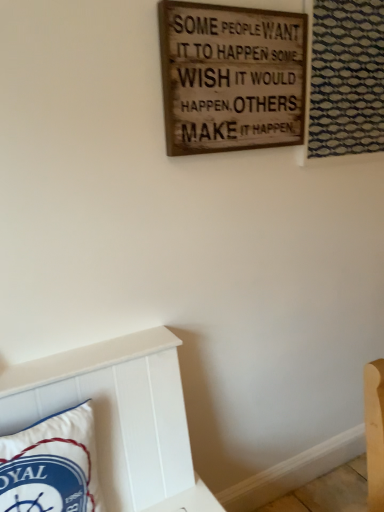
The image size is (384, 512). Find the location of `wooden signboard at upper center`. wooden signboard at upper center is located at coordinates (235, 77).

Find the location of a particular element. The width and height of the screenshot is (384, 512). white fabric pillow at lower left is located at coordinates (52, 465).

At what (x,y) coordinates should I click in order to perform the action: click on wooden signboard at upper center. Please return your answer as a coordinate pair (x, y). This screenshot has width=384, height=512. Looking at the image, I should click on (235, 77).

At what (x,y) coordinates should I click in order to perform the action: click on pillow that appears on the left of wooden signboard at upper center. Please return your answer as a coordinate pair (x, y). Image resolution: width=384 pixels, height=512 pixels. Looking at the image, I should click on (52, 465).

Is wooden signboard at upper center wider or thinner than white fabric pillow at lower left?

In the image, wooden signboard at upper center appears to be more narrow than white fabric pillow at lower left.

From a real-world perspective, between wooden signboard at upper center and white fabric pillow at lower left, who is vertically higher?

wooden signboard at upper center is physically above.

Considering the relative positions of blue textured fabric at upper right and wooden signboard at upper center in the image provided, is blue textured fabric at upper right to the right of wooden signboard at upper center from the viewer's perspective?

Correct, you'll find blue textured fabric at upper right to the right of wooden signboard at upper center.

You are a GUI agent. You are given a task and a screenshot of the screen. Output one action in this format:
    pyautogui.click(x=<x>, y=<y>)
    Task: Click on the tapestry on the right of wooden signboard at upper center
    
    Given the screenshot: What is the action you would take?
    pyautogui.click(x=346, y=78)

Between blue textured fabric at upper right and wooden signboard at upper center, which one has less height?

Standing shorter between the two is wooden signboard at upper center.

Consider the image. Can you tell me how much blue textured fabric at upper right and wooden signboard at upper center differ in facing direction?

The angular difference between blue textured fabric at upper right and wooden signboard at upper center is 0.0471 degrees.

Between blue textured fabric at upper right and white fabric pillow at lower left, which one has larger size?

With larger size is white fabric pillow at lower left.

Based on the photo, from a real-world perspective, which is physically below, blue textured fabric at upper right or white fabric pillow at lower left?

white fabric pillow at lower left, from a real-world perspective.

Based on their positions, is blue textured fabric at upper right located to the left or right of white fabric pillow at lower left?

blue textured fabric at upper right is positioned on white fabric pillow at lower left's right side.

Between blue textured fabric at upper right and white fabric pillow at lower left, which one is positioned behind?

blue textured fabric at upper right.

Based on the photo, from their relative heights in the image, would you say wooden signboard at upper center is taller or shorter than blue textured fabric at upper right?

wooden signboard at upper center is shorter than blue textured fabric at upper right.

Which object is positioned more to the left, wooden signboard at upper center or blue textured fabric at upper right?

From the viewer's perspective, wooden signboard at upper center appears more on the left side.

What's the angular difference between wooden signboard at upper center and blue textured fabric at upper right's facing directions?

They differ by 0.0471 degrees in their facing directions.

Looking at this image, between wooden signboard at upper center and blue textured fabric at upper right, which one has smaller size?

wooden signboard at upper center is smaller.

Who is shorter, white fabric pillow at lower left or blue textured fabric at upper right?

white fabric pillow at lower left.

Do you think white fabric pillow at lower left is within blue textured fabric at upper right, or outside of it?

white fabric pillow at lower left cannot be found inside blue textured fabric at upper right.

Looking at this image, from the image's perspective, which one is positioned higher, white fabric pillow at lower left or blue textured fabric at upper right?

From the image's view, blue textured fabric at upper right is above.

Looking at this image, is white fabric pillow at lower left oriented towards blue textured fabric at upper right?

No, white fabric pillow at lower left is not aimed at blue textured fabric at upper right.

Is white fabric pillow at lower left at the left side of wooden signboard at upper center?

Correct, you'll find white fabric pillow at lower left to the left of wooden signboard at upper center.

Considering the relative sizes of white fabric pillow at lower left and wooden signboard at upper center in the image provided, is white fabric pillow at lower left smaller than wooden signboard at upper center?

Actually, white fabric pillow at lower left might be larger than wooden signboard at upper center.

Could you tell me if white fabric pillow at lower left is turned towards wooden signboard at upper center?

No, white fabric pillow at lower left is not turned towards wooden signboard at upper center.

From a real-world perspective, which is physically below, white fabric pillow at lower left or wooden signboard at upper center?

In real-world perspective, white fabric pillow at lower left is lower.

I want to click on writing above the white fabric pillow at lower left (from a real-world perspective), so click(x=235, y=77).

You are a GUI agent. You are given a task and a screenshot of the screen. Output one action in this format:
    pyautogui.click(x=<x>, y=<y>)
    Task: Click on the writing on the left side of blue textured fabric at upper right
    The width and height of the screenshot is (384, 512).
    Given the screenshot: What is the action you would take?
    pyautogui.click(x=235, y=77)

From the image, which object appears to be farther from wooden signboard at upper center, blue textured fabric at upper right or white fabric pillow at lower left?

white fabric pillow at lower left is positioned further to the anchor wooden signboard at upper center.

From the image, which object appears to be farther from wooden signboard at upper center, white fabric pillow at lower left or blue textured fabric at upper right?

white fabric pillow at lower left.

Considering their positions, is blue textured fabric at upper right positioned further to white fabric pillow at lower left than wooden signboard at upper center?

blue textured fabric at upper right is further to white fabric pillow at lower left.

From the picture: Considering their positions, is wooden signboard at upper center positioned closer to white fabric pillow at lower left than blue textured fabric at upper right?

Based on the image, wooden signboard at upper center appears to be nearer to white fabric pillow at lower left.

Considering their positions, is white fabric pillow at lower left positioned further to blue textured fabric at upper right than wooden signboard at upper center?

white fabric pillow at lower left is further to blue textured fabric at upper right.

Considering their positions, is wooden signboard at upper center positioned closer to blue textured fabric at upper right than white fabric pillow at lower left?

wooden signboard at upper center lies closer to blue textured fabric at upper right than the other object.

The image size is (384, 512). I want to click on writing between blue textured fabric at upper right and white fabric pillow at lower left in the up-down direction, so click(x=235, y=77).